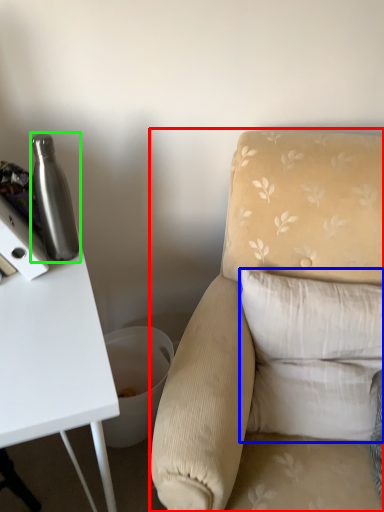
Question: Estimate the real-world distances between objects in this image. Which object is closer to chair (highlighted by a red box), pillow (highlighted by a blue box) or bottle (highlighted by a green box)?

Choices:
 (A) pillow
 (B) bottle

Answer: (A)